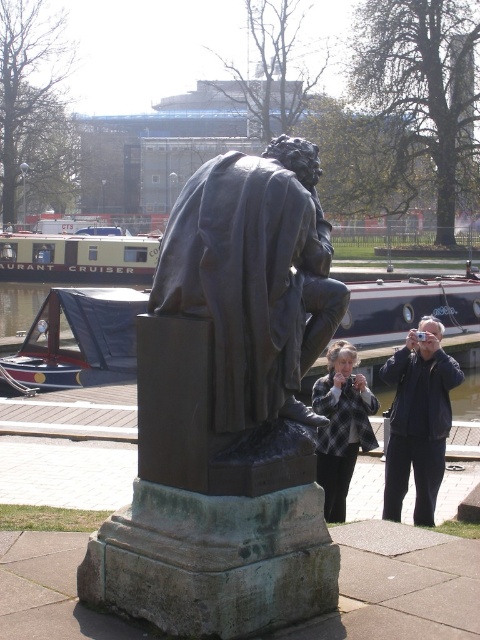
Can you confirm if bronze statue at center is positioned above greenish-gray metal canal cruiser at center-left?

Incorrect, bronze statue at center is not positioned above greenish-gray metal canal cruiser at center-left.

Who is more forward, (194, 260) or (85, 250)?

Positioned in front is point (194, 260).

At what (x,y) coordinates should I click in order to perform the action: click on bronze statue at center. Please return your answer as a coordinate pair (x, y). Looking at the image, I should click on (253, 276).

Is blue canvas boat at center to the left of dark blue jacket at center from the viewer's perspective?

Indeed, blue canvas boat at center is positioned on the left side of dark blue jacket at center.

Which is in front, point (46, 333) or point (414, 429)?

Point (414, 429)

Between point (57, 356) and point (447, 413), which one is positioned in front?

Point (447, 413) is in front.

The image size is (480, 640). I want to click on blue canvas boat at center, so click(x=80, y=339).

Is bronze statue at center above dark blue jacket at center?

Indeed, bronze statue at center is positioned over dark blue jacket at center.

Describe the element at coordinates (253, 276) in the screenshot. Image resolution: width=480 pixels, height=640 pixels. I see `bronze statue at center` at that location.

Is point (232, 176) in front of point (432, 369)?

That is True.

This screenshot has width=480, height=640. Identify the location of bronze statue at center. (253, 276).